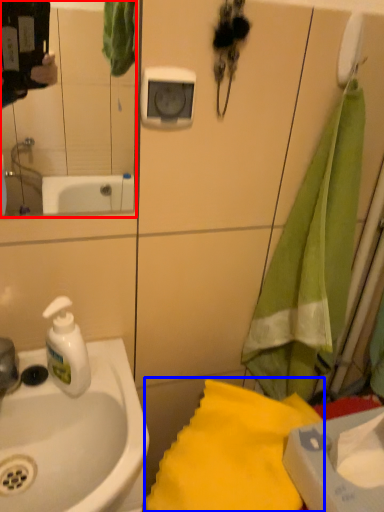
Question: Which object appears closest to the camera in this image, mirror (highlighted by a red box) or beach towel (highlighted by a blue box)?

Choices:
 (A) mirror
 (B) beach towel

Answer: (A)